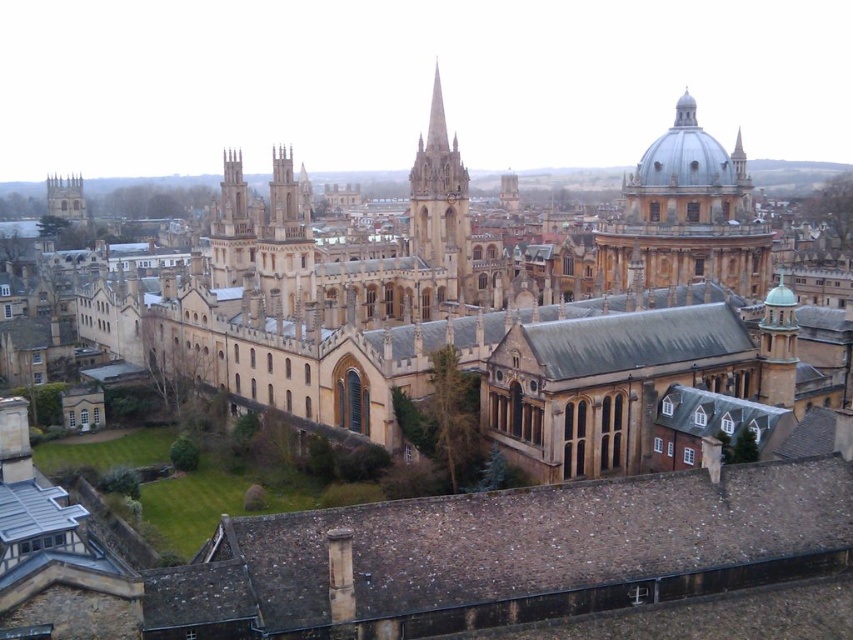
You are standing on the lawn looking towards the historic university buildings. You notice two domes in the upper right corner of your view. Which dome, the smooth stone dome at upper right or the smooth gray dome at upper right, appears closer to you?

The smooth stone dome at upper right appears closer because the smooth gray dome at upper right is positioned behind it.